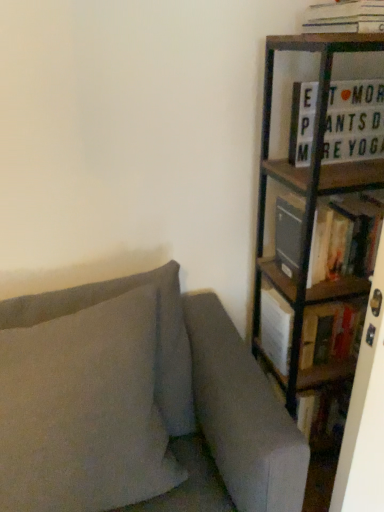
Question: Is suede-like gray pillow at left looking in the opposite direction of wooden bookcase at right?

Choices:
 (A) no
 (B) yes

Answer: (A)

Question: Considering the relative positions of suede-like gray pillow at left and wooden bookcase at right in the image provided, is suede-like gray pillow at left to the right of wooden bookcase at right from the viewer's perspective?

Choices:
 (A) no
 (B) yes

Answer: (A)

Question: Considering the relative sizes of suede-like gray pillow at left and wooden bookcase at right in the image provided, is suede-like gray pillow at left smaller than wooden bookcase at right?

Choices:
 (A) no
 (B) yes

Answer: (B)

Question: From a real-world perspective, does suede-like gray pillow at left sit lower than wooden bookcase at right?

Choices:
 (A) no
 (B) yes

Answer: (B)

Question: Is suede-like gray pillow at left further to camera compared to wooden bookcase at right?

Choices:
 (A) yes
 (B) no

Answer: (B)

Question: Considering the relative positions of hardcover book at right, the 3th book positioned from the top, and wooden bookcase at right in the image provided, is hardcover book at right, the 3th book positioned from the top, to the left or to the right of wooden bookcase at right?

Choices:
 (A) right
 (B) left

Answer: (B)

Question: From the image's perspective, is hardcover book at right, which is the 1th book from bottom to top, above or below wooden bookcase at right?

Choices:
 (A) below
 (B) above

Answer: (A)

Question: From a real-world perspective, relative to wooden bookcase at right, is hardcover book at right, which is the 1th book from bottom to top, vertically above or below?

Choices:
 (A) below
 (B) above

Answer: (A)

Question: Is hardcover book at right, the 3th book positioned from the top, situated inside wooden bookcase at right or outside?

Choices:
 (A) outside
 (B) inside

Answer: (B)

Question: In terms of size, does suede-like gray pillow at left appear bigger or smaller than hardcover book at right, which is the 1th book from bottom to top?

Choices:
 (A) small
 (B) big

Answer: (B)

Question: Considering the relative positions of suede-like gray pillow at left and hardcover book at right, the 3th book positioned from the top, in the image provided, is suede-like gray pillow at left to the left or to the right of hardcover book at right, the 3th book positioned from the top,?

Choices:
 (A) left
 (B) right

Answer: (A)

Question: From the image's perspective, is suede-like gray pillow at left positioned above or below hardcover book at right, which is the 1th book from bottom to top?

Choices:
 (A) below
 (B) above

Answer: (A)

Question: Would you say suede-like gray pillow at left is inside or outside hardcover book at right, which is the 1th book from bottom to top?

Choices:
 (A) outside
 (B) inside

Answer: (A)

Question: From the image's perspective, is wooden bookcase at right located above or below white paper stack at upper right, which ranks as the first book in top-to-bottom order?

Choices:
 (A) above
 (B) below

Answer: (B)

Question: Considering the positions of wooden bookcase at right and white paper stack at upper right, which ranks as the first book in top-to-bottom order, in the image, is wooden bookcase at right wider or thinner than white paper stack at upper right, which ranks as the first book in top-to-bottom order,?

Choices:
 (A) wide
 (B) thin

Answer: (A)